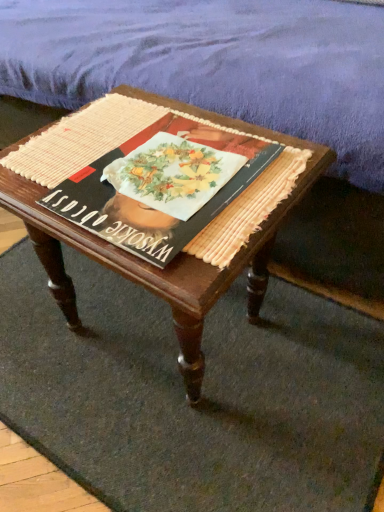
This screenshot has width=384, height=512. What are the coordinates of `unoccupied space behind matte black book at center` in the screenshot? It's located at (146, 118).